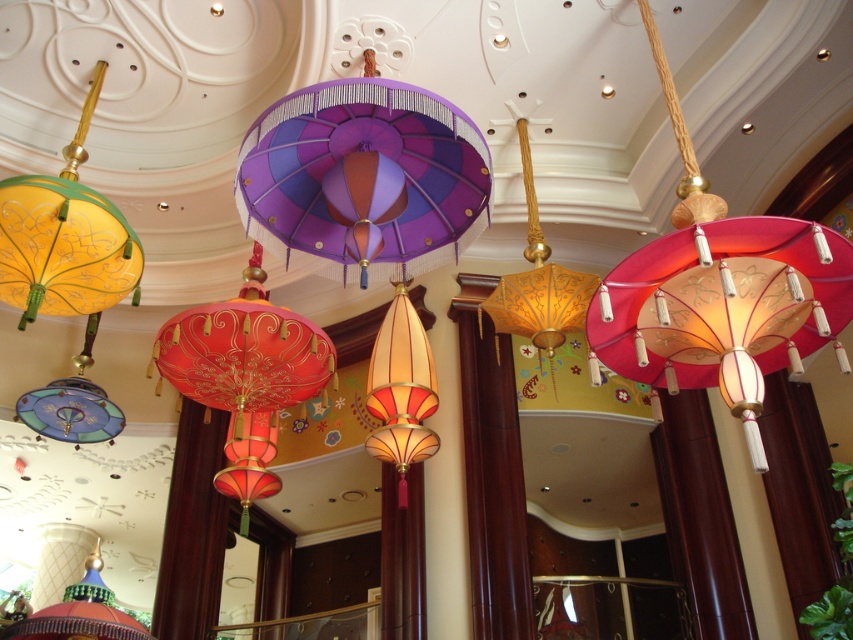
Question: Based on their relative distances, which object is nearer to the gold paper lantern at center?

Choices:
 (A) matte red paper lantern at right
 (B) purple satin lantern at center
 (C) blue glass lantern at center

Answer: (B)

Question: Which object is the closest to the matte red paper lantern at right?

Choices:
 (A) purple satin lantern at center
 (B) blue glass lantern at center

Answer: (A)

Question: Does matte red paper lantern at right appear on the left side of purple satin lantern at center?

Choices:
 (A) no
 (B) yes

Answer: (A)

Question: Is matte red paper lantern at right positioned behind purple satin lantern at center?

Choices:
 (A) yes
 (B) no

Answer: (B)

Question: Is matte red paper lantern at right closer to camera compared to gold paper lantern at center?

Choices:
 (A) no
 (B) yes

Answer: (B)

Question: Which object is closer to the camera taking this photo?

Choices:
 (A) gold paper lantern at center
 (B) purple satin lantern at center
 (C) matte red paper lantern at right

Answer: (C)